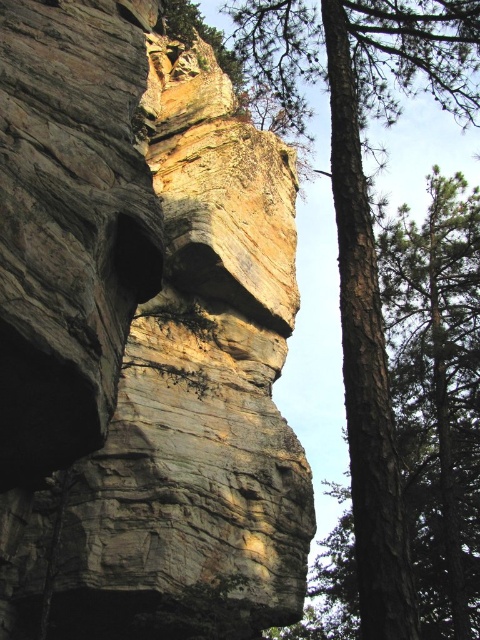
Does rustic stone cliff face at center appear on the right side of brown rough bark tree at right?

Incorrect, rustic stone cliff face at center is not on the right side of brown rough bark tree at right.

Identify the location of rustic stone cliff face at center. tap(142, 337).